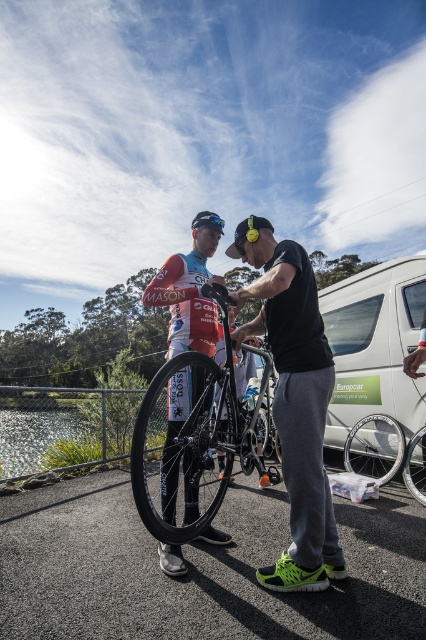
Is black matte bicycle at center shorter than shiny black frame at center?

No, black matte bicycle at center is not shorter than shiny black frame at center.

Who is more forward, (307,516) or (207,365)?

Positioned in front is point (307,516).

The height and width of the screenshot is (640, 426). Identify the location of black matte bicycle at center. (293, 400).

Where is `shiny black frame at center`? shiny black frame at center is located at coordinates (189, 444).

Does shiny black frame at center have a smaller size compared to shiny black bicycle at center?

No, shiny black frame at center is not smaller than shiny black bicycle at center.

This screenshot has height=640, width=426. What are the coordinates of `shiny black frame at center` in the screenshot? It's located at (189, 444).

Between shiny black bicycle at center and matte black helmet at center, which one is positioned higher?

matte black helmet at center

Is shiny black bicycle at center behind matte black helmet at center?

Yes, it is.

I want to click on shiny black bicycle at center, so click(x=416, y=467).

The width and height of the screenshot is (426, 640). I want to click on shiny black bicycle at center, so click(x=416, y=467).